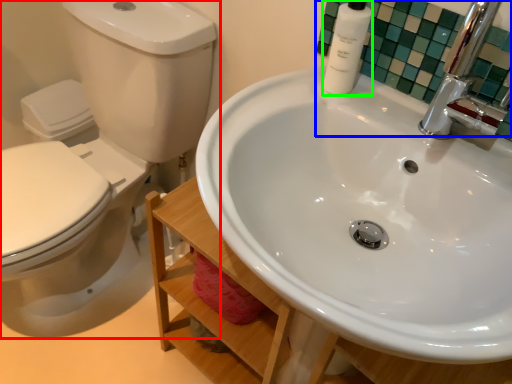
Question: Which object is positioned farthest from toilet (highlighted by a red box)? Select from mirror (highlighted by a blue box) and toiletry (highlighted by a green box).

Choices:
 (A) mirror
 (B) toiletry

Answer: (B)